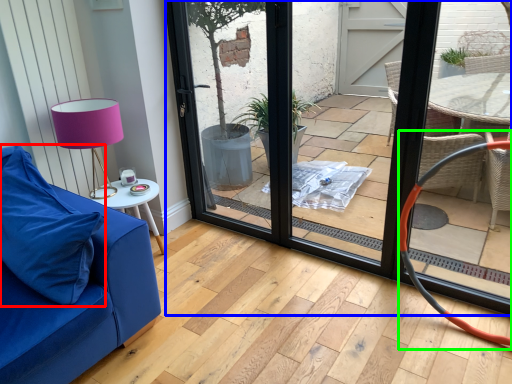
Question: Based on their relative distances, which object is farther from pillow (highlighted by a red box)? Choose from door (highlighted by a blue box) and armchair (highlighted by a green box).

Choices:
 (A) door
 (B) armchair

Answer: (B)